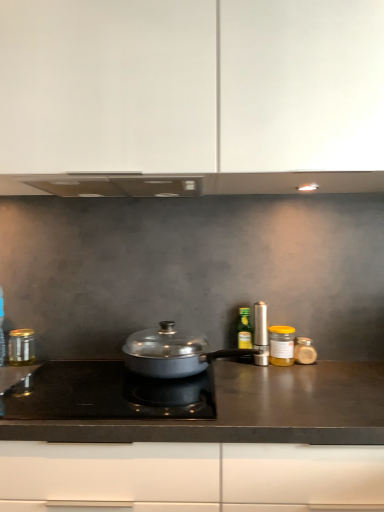
This screenshot has width=384, height=512. In order to click on vacant space to the left of yellow glass jar at right, the 5th kitchen appliance positioned from the left in this screenshot , I will do `click(233, 366)`.